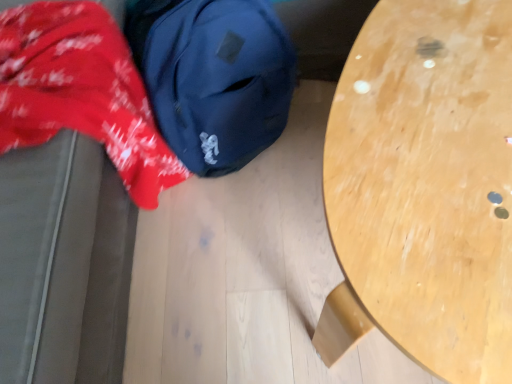
This screenshot has width=512, height=384. I want to click on free point above light wood table at center (from a real-world perspective), so click(454, 117).